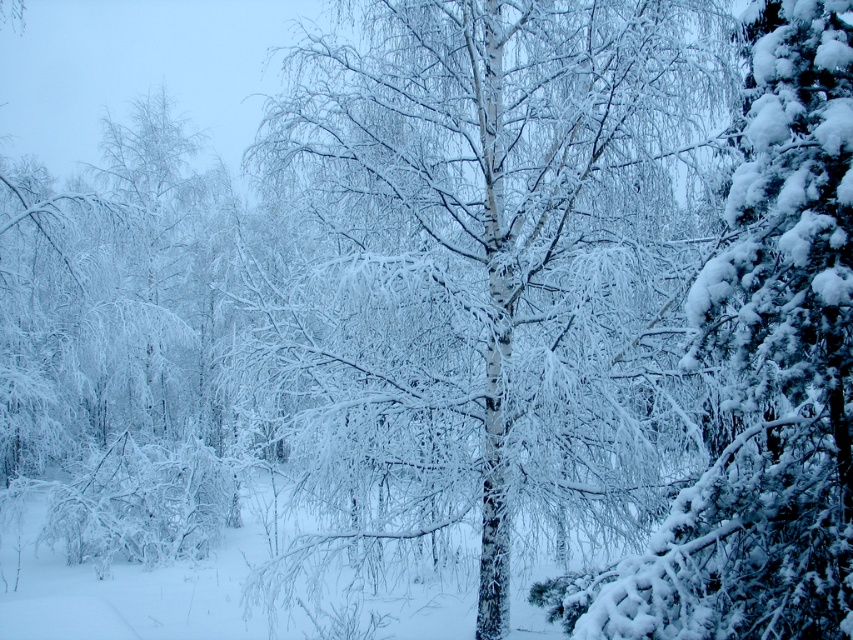
Is white matte tree at center thinner than snow-covered pine at right?

In fact, white matte tree at center might be wider than snow-covered pine at right.

Who is positioned more to the right, white matte tree at center or snow-covered pine at right?

snow-covered pine at right

Is point (665, 3) positioned behind point (764, 52)?

Yes, point (665, 3) is farther from viewer.

Find the location of `white matte tree at center`. white matte tree at center is located at coordinates (488, 264).